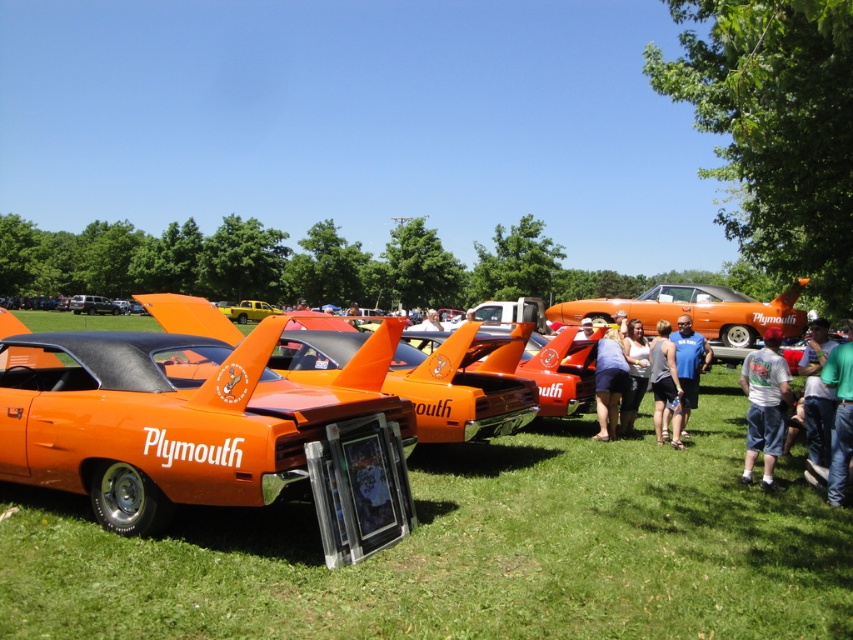
Is matte orange plymouth car at center to the left of matte black shirt at center from the viewer's perspective?

Correct, you'll find matte orange plymouth car at center to the left of matte black shirt at center.

Does matte orange plymouth car at center appear on the right side of matte black shirt at center?

In fact, matte orange plymouth car at center is to the left of matte black shirt at center.

Identify the location of matte orange plymouth car at center. The image size is (853, 640). (91, 305).

Does green grass at center have a smaller size compared to matte white tank top at center?

No.

Which is in front, point (664, 476) or point (631, 360)?

Point (664, 476) is more forward.

Which is behind, point (459, 588) or point (624, 339)?

The point (624, 339) is behind.

I want to click on green grass at center, so click(466, 550).

Can you confirm if green grass at center is smaller than green fabric shirt at lower right?

No.

Is green grass at center thinner than green fabric shirt at lower right?

Incorrect, green grass at center's width is not less than green fabric shirt at lower right's.

Is point (103, 540) positioned behind point (805, 429)?

That is False.

In order to click on green grass at center in this screenshot , I will do `click(466, 550)`.